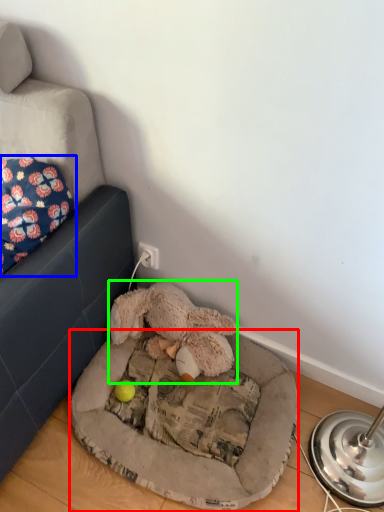
Question: Based on their relative distances, which object is farther from dog bed (highlighted by a red box)? Choose from pillow (highlighted by a blue box) and toy (highlighted by a green box).

Choices:
 (A) pillow
 (B) toy

Answer: (A)